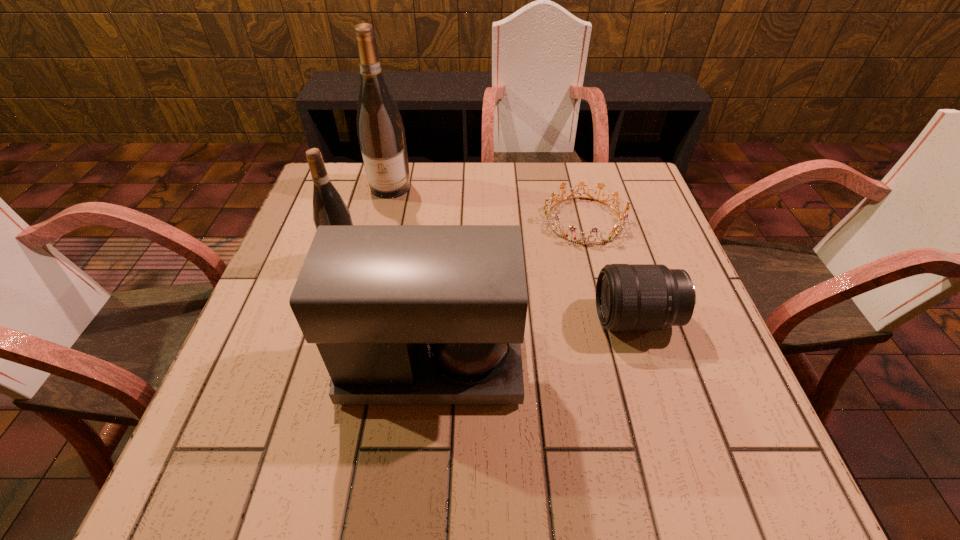
Image resolution: width=960 pixels, height=540 pixels. What are the coordinates of `blank space located on the surface of the telephoto lens` in the screenshot? It's located at (548, 319).

Identify the location of vacant space located 0.250m on the surface of the telephoto lens. This screenshot has height=540, width=960. (475, 319).

You are a GUI agent. You are given a task and a screenshot of the screen. Output one action in this format:
    pyautogui.click(x=<x>, y=<y>)
    Task: Click on the vacant region located 0.180m on the surface of the telephoto lens
    
    Given the screenshot: What is the action you would take?
    pyautogui.click(x=509, y=319)

This screenshot has width=960, height=540. In order to click on free spot located on the front-facing side of the tiara in this screenshot , I will do `click(524, 220)`.

You are a GUI agent. You are given a task and a screenshot of the screen. Output one action in this format:
    pyautogui.click(x=<x>, y=<y>)
    Task: Click on the vacant area situated 0.130m on the front-facing side of the tiara
    Image resolution: width=960 pixels, height=540 pixels.
    Given the screenshot: What is the action you would take?
    pyautogui.click(x=492, y=220)

Find the location of a particular element. The height and width of the screenshot is (540, 960). vacant space located on the front-facing side of the tiara is located at coordinates (496, 220).

Find the location of a particular element. The width and height of the screenshot is (960, 540). wine bottle that is at the far edge is located at coordinates (381, 134).

This screenshot has width=960, height=540. I want to click on tiara positioned at the far edge, so click(618, 230).

Where is `telephoto lens that is at the right edge`? This screenshot has height=540, width=960. telephoto lens that is at the right edge is located at coordinates (629, 297).

At what (x,y) coordinates should I click in order to perform the action: click on tiara that is at the right edge. Please return your answer as a coordinate pair (x, y). Looking at the image, I should click on (618, 230).